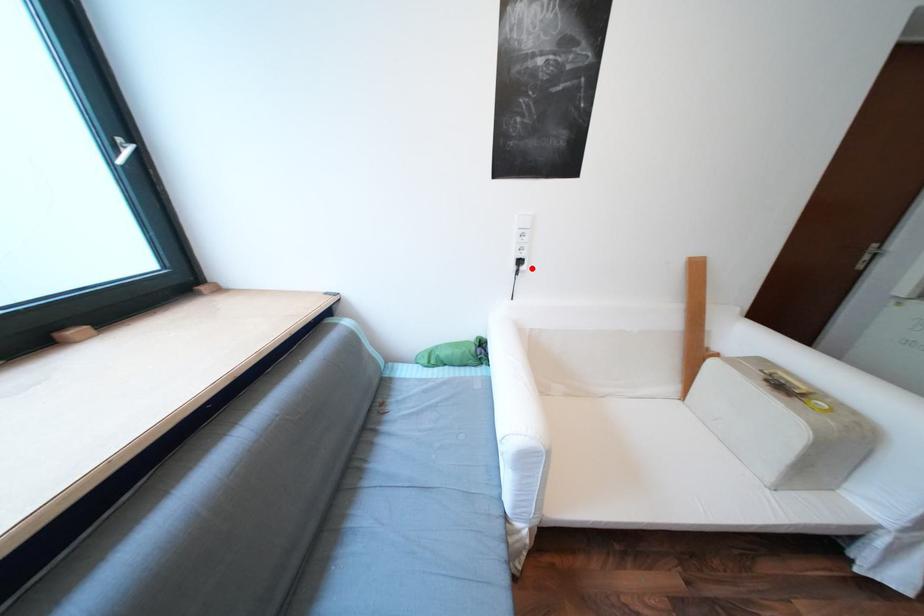
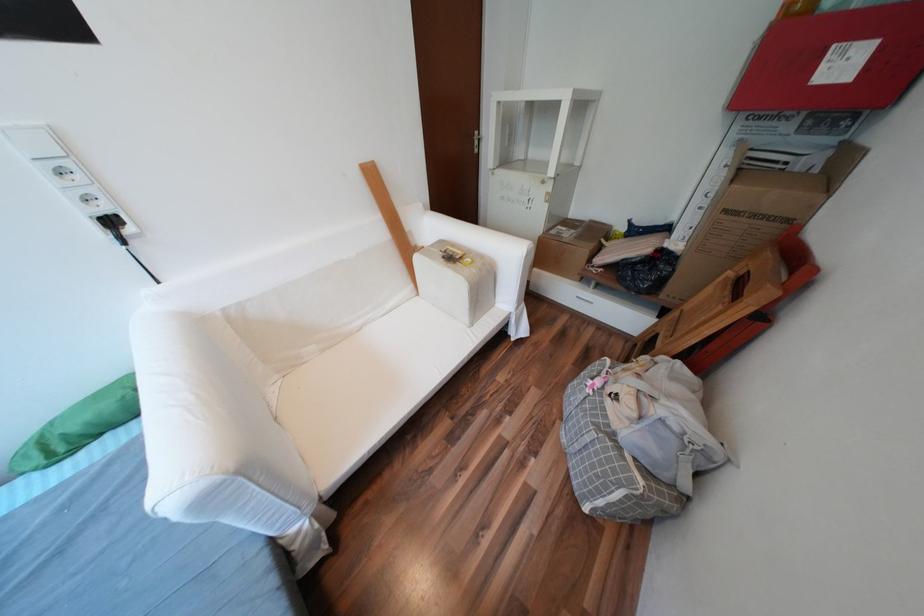
Locate, in the second image, the point that corresponds to the highlighted location in the first image.

(138, 231)